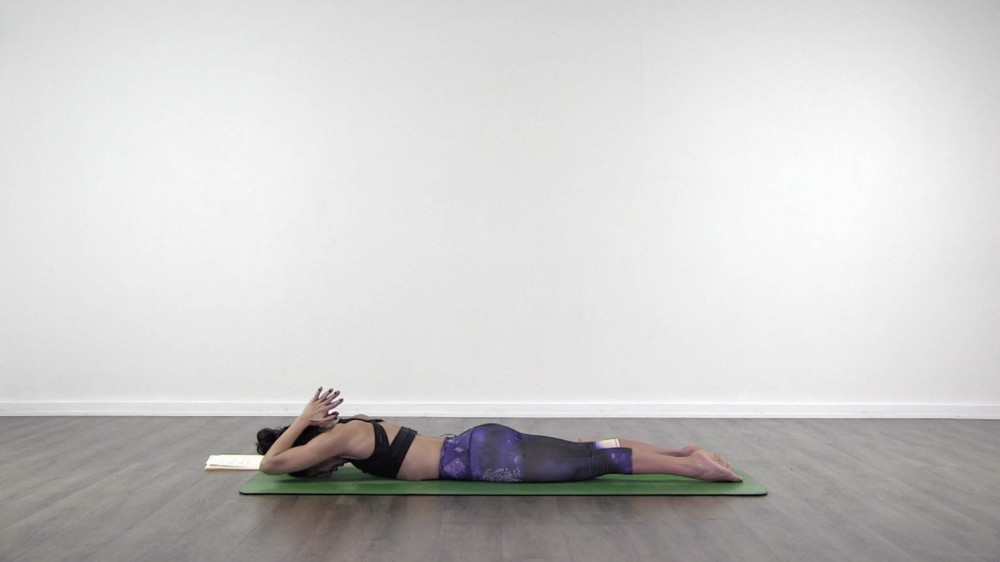
Where is `wall`? The width and height of the screenshot is (1000, 562). wall is located at coordinates (531, 202).